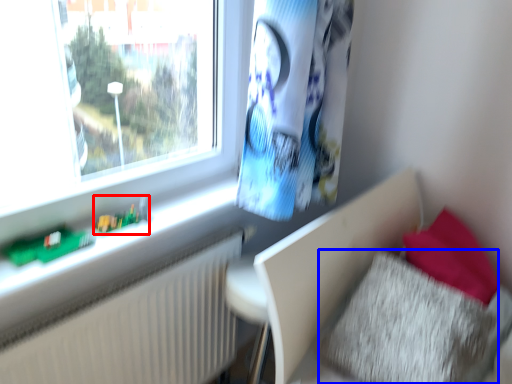
Question: Which object is closer to the camera taking this photo, toy (highlighted by a red box) or pillow (highlighted by a blue box)?

Choices:
 (A) toy
 (B) pillow

Answer: (B)